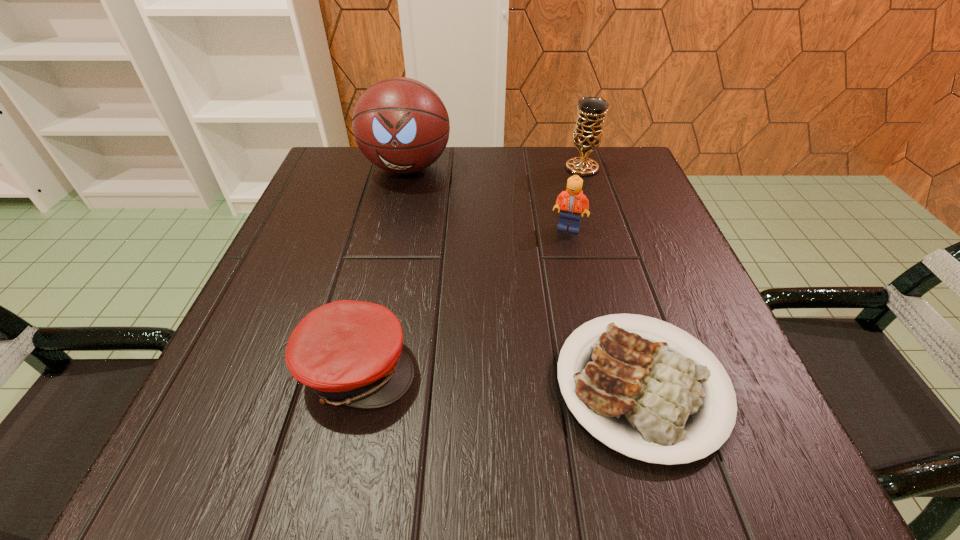
The width and height of the screenshot is (960, 540). Find the location of `vacant space that satisfies the following two spatial constraints: 1. on the front side of the shortest object; 2. on the left side of the tallest object`. vacant space that satisfies the following two spatial constraints: 1. on the front side of the shortest object; 2. on the left side of the tallest object is located at coordinates (357, 386).

Where is `vacant area in the image that satisfies the following two spatial constraints: 1. on the front side of the chalice; 2. on the front of the cap with an emblem`? This screenshot has width=960, height=540. vacant area in the image that satisfies the following two spatial constraints: 1. on the front side of the chalice; 2. on the front of the cap with an emblem is located at coordinates (646, 368).

This screenshot has width=960, height=540. Find the location of `free location that satisfies the following two spatial constraints: 1. on the front of the second shortest object with an emblem; 2. on the right side of the plate`. free location that satisfies the following two spatial constraints: 1. on the front of the second shortest object with an emblem; 2. on the right side of the plate is located at coordinates click(354, 386).

Find the location of `blank space that satisfies the following two spatial constraints: 1. on the front side of the basketball; 2. on the front of the second shortest object with an emblem`. blank space that satisfies the following two spatial constraints: 1. on the front side of the basketball; 2. on the front of the second shortest object with an emblem is located at coordinates (361, 368).